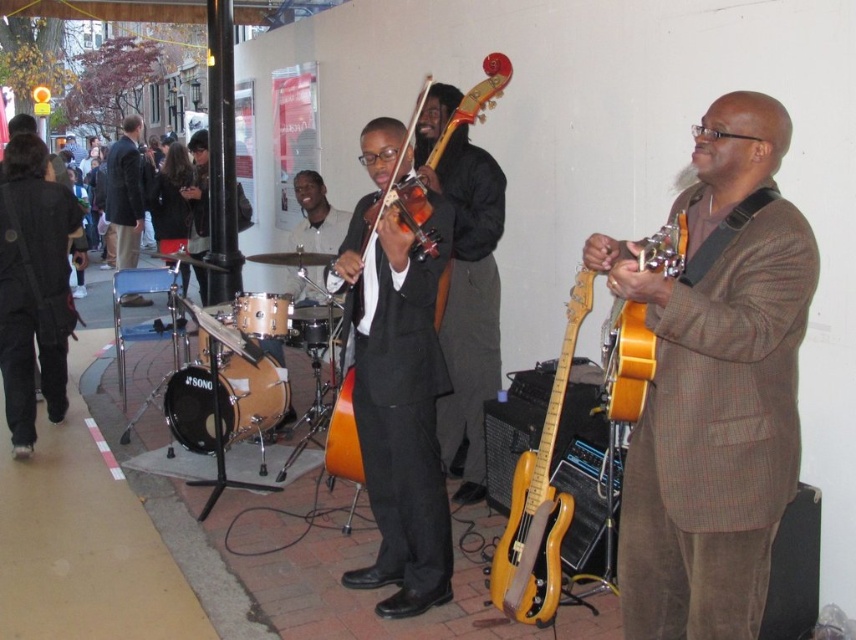
Who is lower down, brown wooden drum at lower left or dark brown suit at left?

Positioned lower is brown wooden drum at lower left.

This screenshot has height=640, width=856. Describe the element at coordinates (250, 396) in the screenshot. I see `brown wooden drum at lower left` at that location.

What are the coordinates of `brown wooden drum at lower left` in the screenshot? It's located at [x=250, y=396].

Where is `matte brown suit at center`? The width and height of the screenshot is (856, 640). matte brown suit at center is located at coordinates (715, 385).

This screenshot has height=640, width=856. Describe the element at coordinates (715, 385) in the screenshot. I see `matte brown suit at center` at that location.

Image resolution: width=856 pixels, height=640 pixels. Identify the location of matte brown suit at center. (715, 385).

Is matte yellow guitar at right further to camera compared to brushed metal drum at center?

No, matte yellow guitar at right is closer to the viewer.

Does matte yellow guitar at right have a greater width compared to brushed metal drum at center?

In fact, matte yellow guitar at right might be narrower than brushed metal drum at center.

Does point (642, 269) come farther from viewer compared to point (296, 330)?

No, it is in front of (296, 330).

The width and height of the screenshot is (856, 640). I want to click on matte yellow guitar at right, so click(x=626, y=362).